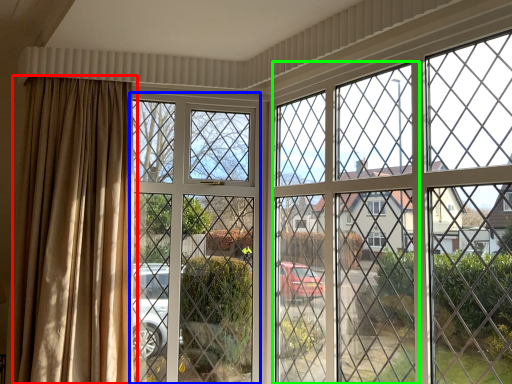
Question: Which object is the farthest from curtain (highlighted by a red box)? Choose among these: screen door (highlighted by a blue box) or screen door (highlighted by a green box).

Choices:
 (A) screen door
 (B) screen door

Answer: (B)